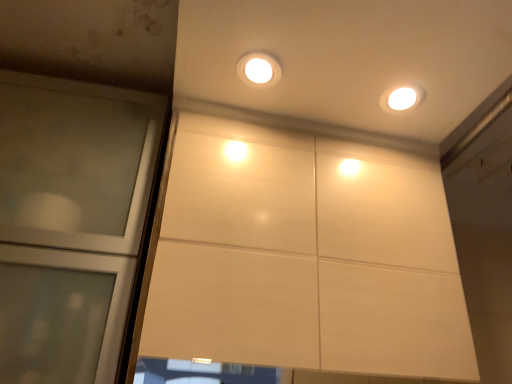
Question: Considering the relative positions of matte white light fixture at upper center and transparent glass door at left in the image provided, is matte white light fixture at upper center in front of transparent glass door at left?

Choices:
 (A) yes
 (B) no

Answer: (B)

Question: From a real-world perspective, is matte white light fixture at upper center physically below transparent glass door at left?

Choices:
 (A) no
 (B) yes

Answer: (A)

Question: Is matte white light fixture at upper center positioned with its back to transparent glass door at left?

Choices:
 (A) no
 (B) yes

Answer: (A)

Question: Is matte white light fixture at upper center completely or partially outside of transparent glass door at left?

Choices:
 (A) no
 (B) yes

Answer: (B)

Question: Would you say matte white light fixture at upper center contains transparent glass door at left?

Choices:
 (A) no
 (B) yes

Answer: (A)

Question: From the image's perspective, does matte white light fixture at upper center appear lower than transparent glass door at left?

Choices:
 (A) yes
 (B) no

Answer: (B)

Question: Is transparent glass door at left not near matte white light fixture at upper center?

Choices:
 (A) yes
 (B) no

Answer: (B)

Question: From the image's perspective, is transparent glass door at left below matte white light fixture at upper center?

Choices:
 (A) yes
 (B) no

Answer: (A)

Question: Is matte white light fixture at upper center at the back of transparent glass door at left?

Choices:
 (A) no
 (B) yes

Answer: (A)

Question: Would you say matte white light fixture at upper center is part of transparent glass door at left's contents?

Choices:
 (A) yes
 (B) no

Answer: (B)

Question: Is transparent glass door at left positioned in front of matte white light fixture at upper center?

Choices:
 (A) yes
 (B) no

Answer: (A)

Question: Considering the relative sizes of transparent glass door at left and matte white light fixture at upper center in the image provided, is transparent glass door at left smaller than matte white light fixture at upper center?

Choices:
 (A) yes
 (B) no

Answer: (B)

Question: Looking at the image, does matte white light fixture at upper center seem bigger or smaller compared to transparent glass door at left?

Choices:
 (A) big
 (B) small

Answer: (B)